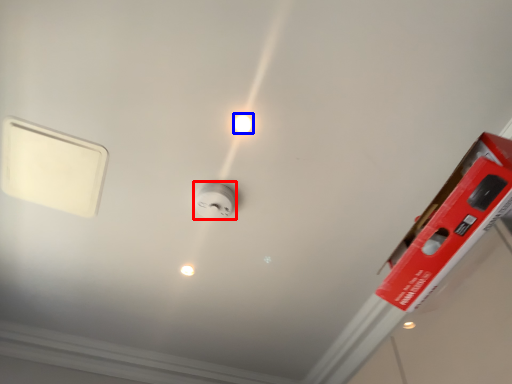
Question: Which object is closer to the camera taking this photo, power plugs and sockets (highlighted by a red box) or light bulb (highlighted by a blue box)?

Choices:
 (A) power plugs and sockets
 (B) light bulb

Answer: (B)